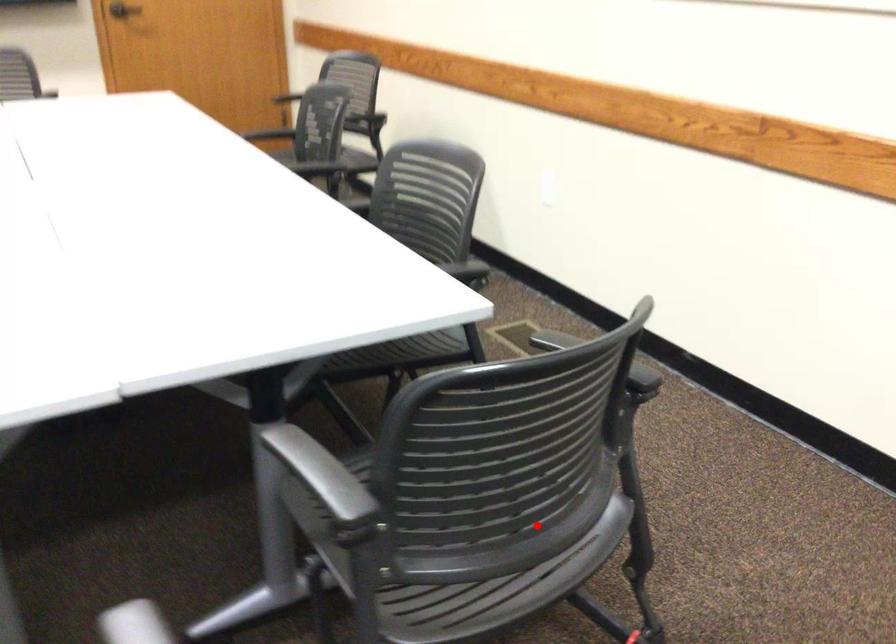
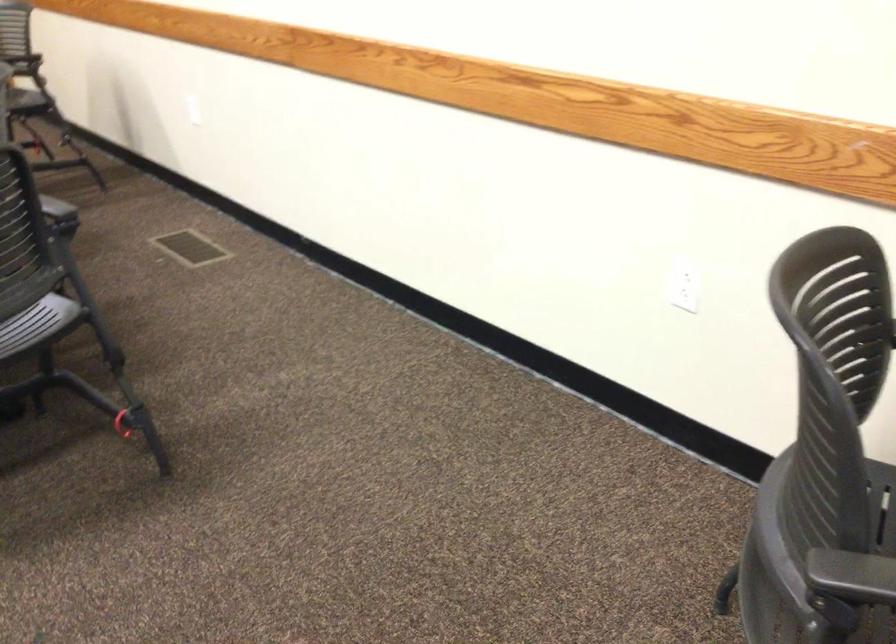
In the second image, find the point that corresponds to the highlighted location in the first image.

(37, 323)